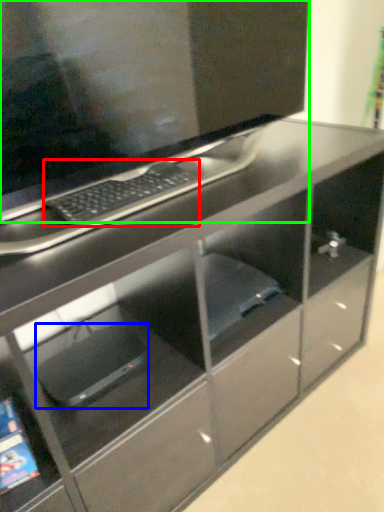
Question: Which object is positioned farthest from computer keyboard (highlighted by a red box)? Select from computer (highlighted by a blue box) and computer monitor (highlighted by a green box).

Choices:
 (A) computer
 (B) computer monitor

Answer: (A)